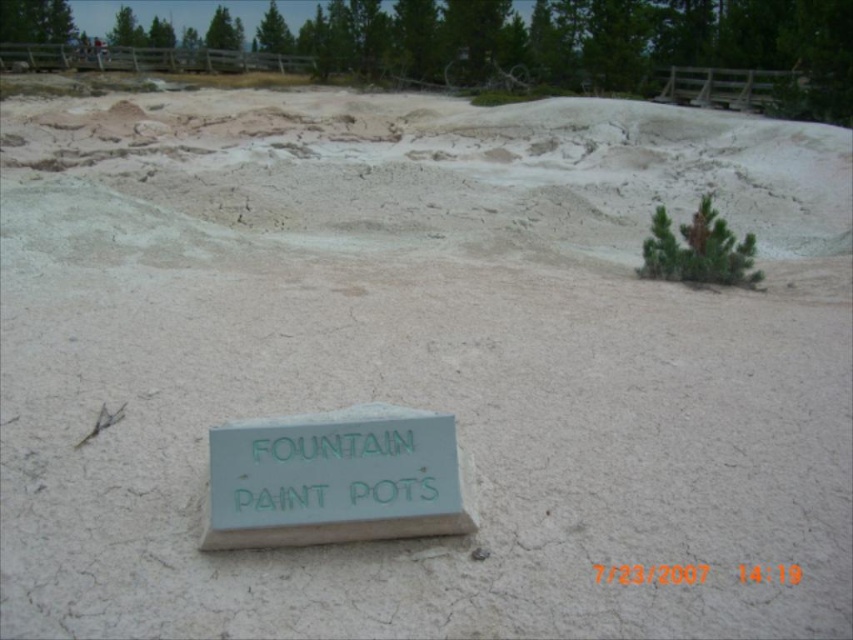
Describe the element at coordinates (334, 477) in the screenshot. The height and width of the screenshot is (640, 853). I see `green painted wood sign at lower center` at that location.

Can you confirm if green painted wood sign at lower center is wider than green leafy pine at upper right?

No, green painted wood sign at lower center is not wider than green leafy pine at upper right.

Is point (415, 436) positioned after point (726, 269)?

No, (415, 436) is closer to viewer.

This screenshot has height=640, width=853. In order to click on green painted wood sign at lower center in this screenshot , I will do click(x=334, y=477).